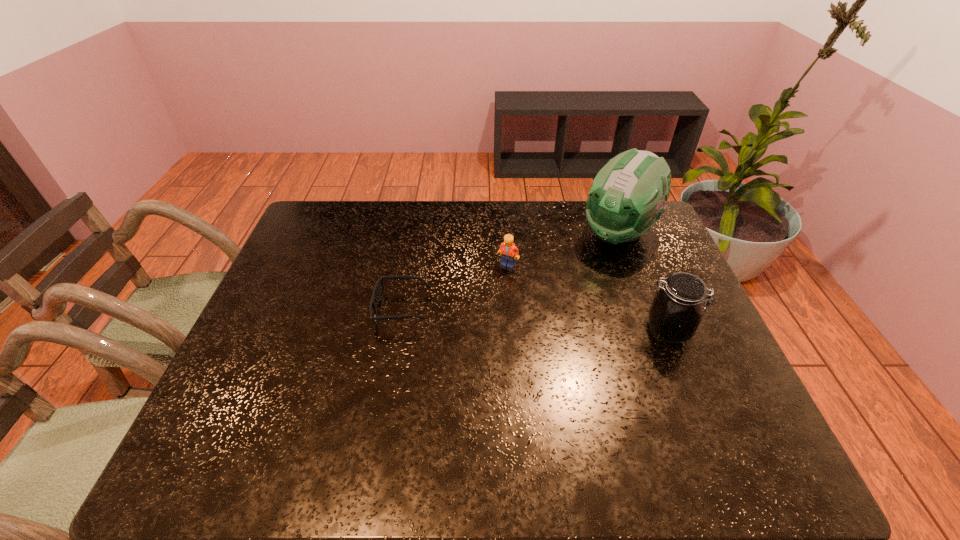
Where is `the leftmost object`? This screenshot has width=960, height=540. the leftmost object is located at coordinates (379, 289).

Find the location of a particular element. This screenshot has width=960, height=540. the shortest object is located at coordinates (379, 289).

I want to click on jar, so click(x=675, y=313).

You are a GUI agent. You are given a task and a screenshot of the screen. Output one action in this format:
    pyautogui.click(x=<x>, y=<y>)
    Task: Click on the third object from right to left
    The height and width of the screenshot is (540, 960).
    Given the screenshot: What is the action you would take?
    pyautogui.click(x=509, y=252)

Identify the location of Lego. The image size is (960, 540). (509, 252).

This screenshot has width=960, height=540. I want to click on the tallest object, so click(627, 197).

You are a GUI agent. You are given a task and a screenshot of the screen. Output one action in this format:
    pyautogui.click(x=<x>, y=<y>)
    Task: Click on the vacant space located on the front-facing side of the leftmost object
    This screenshot has width=960, height=540.
    Given the screenshot: What is the action you would take?
    pyautogui.click(x=296, y=308)

What are the coordinates of `vacant space located 0.170m on the front-facing side of the leftmost object` in the screenshot? It's located at (311, 308).

At what (x,y) coordinates should I click in order to perform the action: click on vacant space located 0.180m on the front-facing side of the leftmost object. Please return your answer as a coordinate pair (x, y). Looking at the image, I should click on (307, 308).

Find the location of a particular element. vacant region located 0.260m on the front-facing side of the Lego is located at coordinates (499, 337).